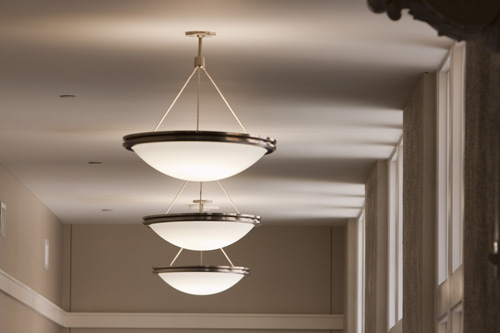
At what (x,y) coordinates should I click in order to perform the action: click on windows. Please return your answer as a coordinate pair (x, y). Looking at the image, I should click on (457, 206), (393, 213), (355, 247).